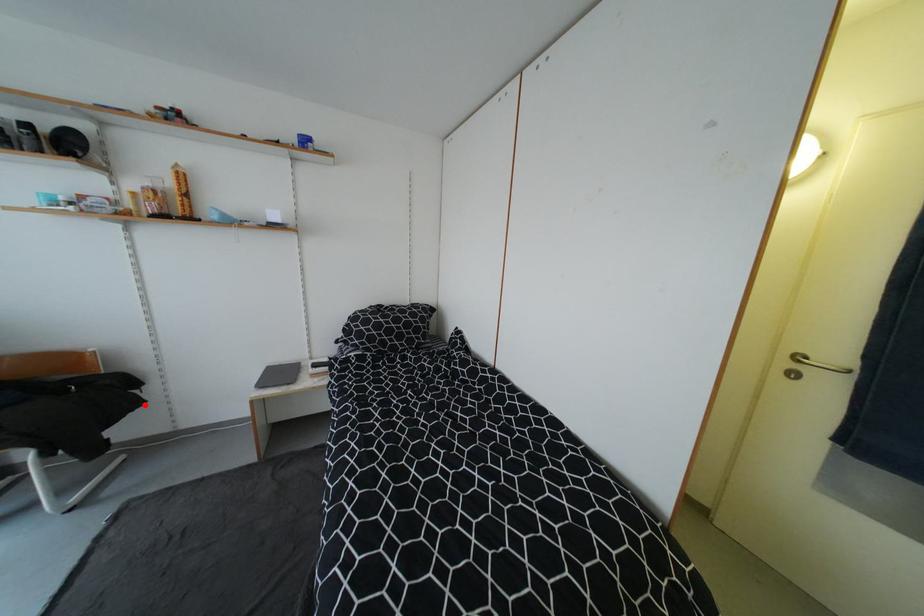
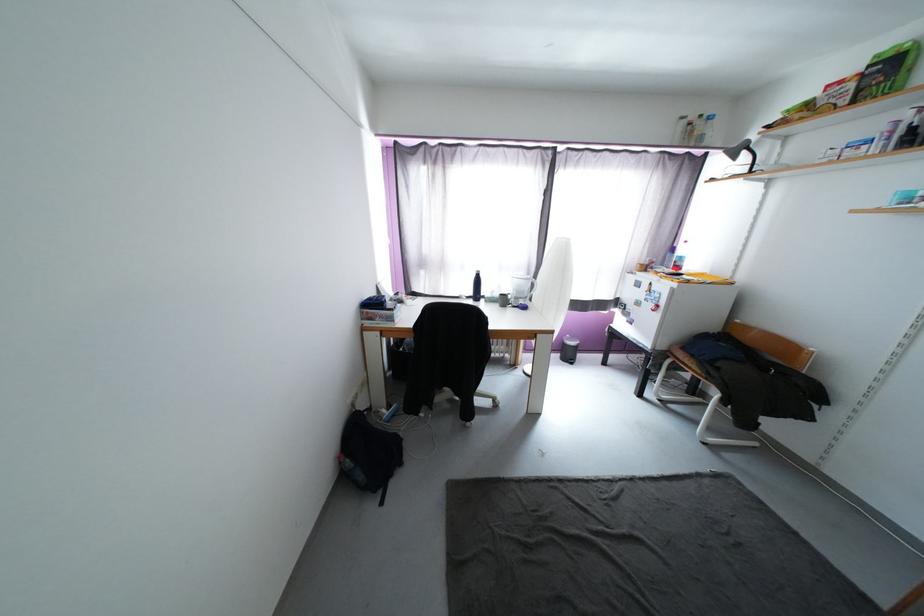
In the second image, find the point that corresponds to the highlighted location in the first image.

(812, 419)